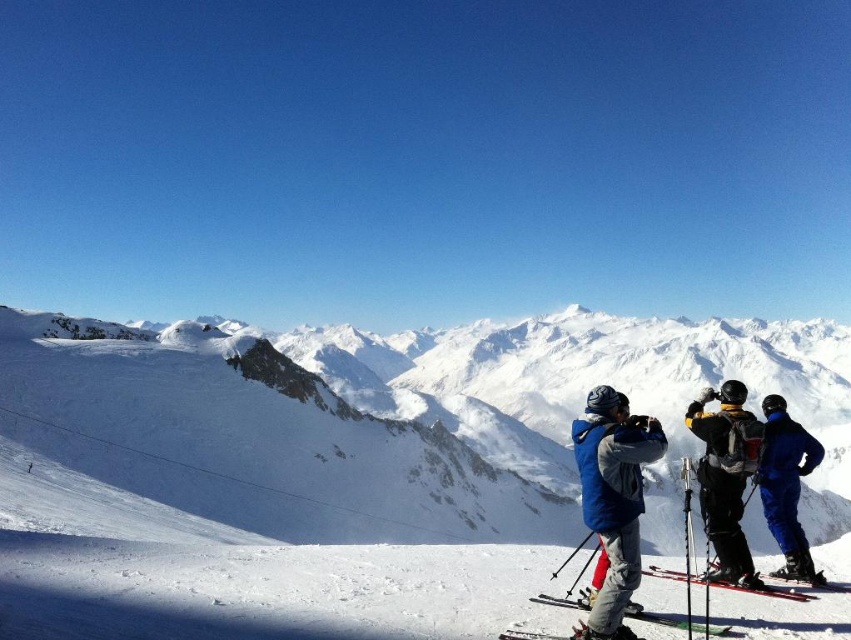
Question: Does white snow-covered mountain at center appear on the left side of metallic red ski at lower right?

Choices:
 (A) yes
 (B) no

Answer: (B)

Question: Does blue fleece jacket at center appear on the left side of black matte ski suit at center right?

Choices:
 (A) no
 (B) yes

Answer: (B)

Question: Which of the following is the closest to the observer?

Choices:
 (A) white snow-covered mountain at center
 (B) green matte ski at lower center

Answer: (B)

Question: Which of these objects is positioned closest to the blue ski suit at right?

Choices:
 (A) blue fleece jacket at center
 (B) black matte ski suit at center right
 (C) green matte ski at lower center
 (D) metallic red ski at lower right

Answer: (B)

Question: Where is blue ski suit at right located in relation to metallic red ski at lower right in the image?

Choices:
 (A) above
 (B) below

Answer: (A)

Question: Which is nearer to the white snow-covered mountain at center?

Choices:
 (A) blue fleece jacket at center
 (B) blue ski suit at right
 (C) metallic red ski at lower right
 (D) green matte ski at lower center

Answer: (C)